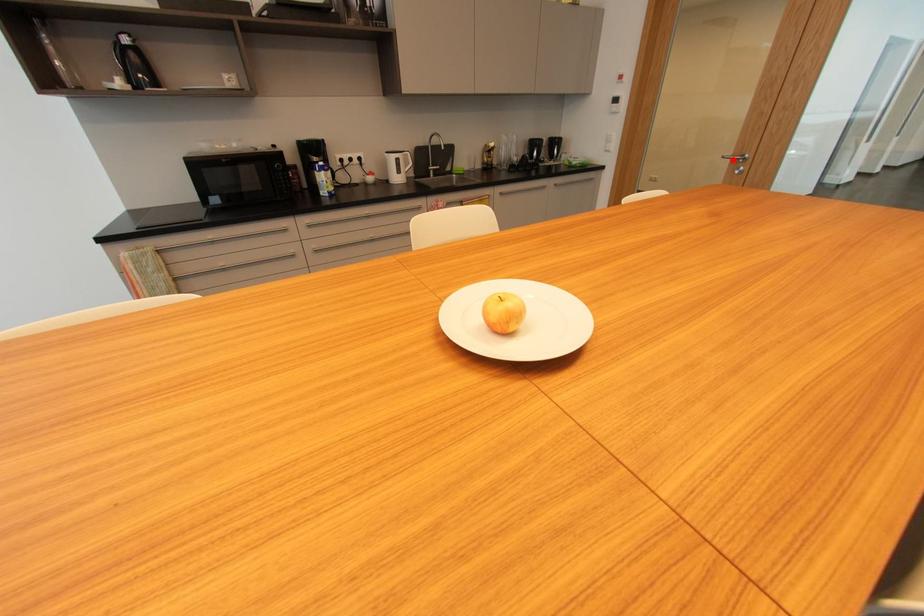
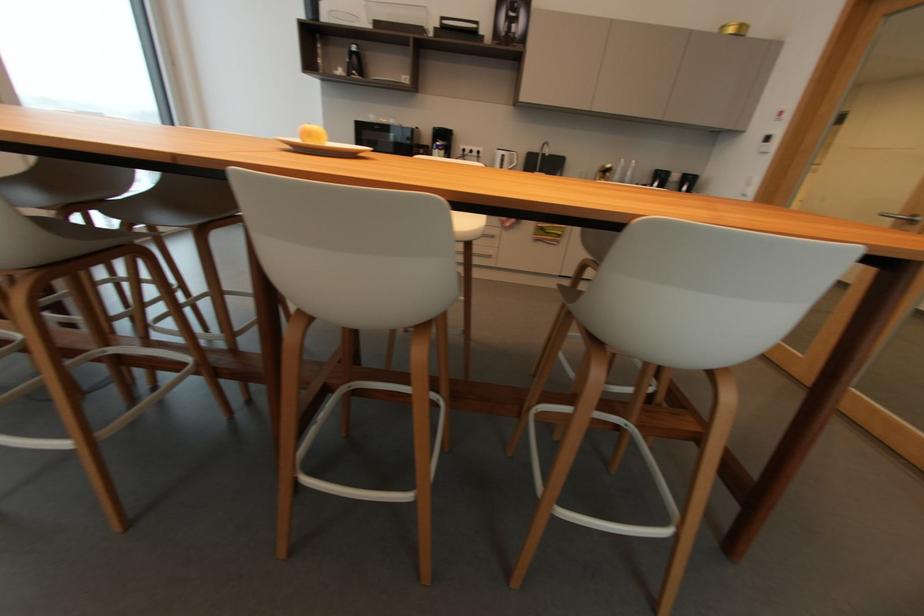
Question: I am providing you with two images of the same scene from different viewpoints. Image1 has a red point marked. In image2, the corresponding 3D location appears at what relative position? Reply with the corresponding letter.

Choices:
 (A) Closer
 (B) Farther

Answer: (B)